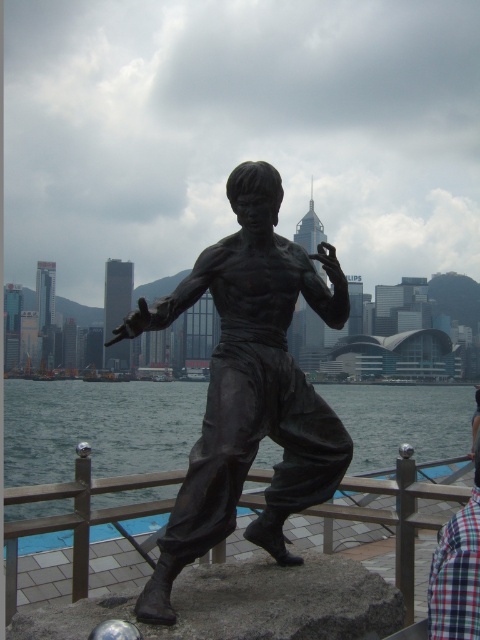
You are a tourist standing in front of the bronze statue of a martial artist. You notice a brown wooden rail at lower center and a plaid fabric shirt at lower right. Which object is closer to you?

The brown wooden rail at lower center is closer to you because it is further to the viewer than the plaid fabric shirt at lower right.

In the scene shown: You are a painter standing at the base of the bronze statue of a martial artist. You want to paint a scene that includes both the brown wooden rail at lower center and the plaid fabric shirt at lower right. Which object should you focus on first if you want to paint the wider object first?

The brown wooden rail at lower center should be focused on first because its width is larger than the plaid fabric shirt at lower right.

You are a tourist standing in front of the bronze statue at center and the brown wooden rail at lower center. You want to take a photo of the statue without the rail appearing in the frame. Which direction should you move to achieve this?

The bronze statue at center is in front of the brown wooden rail at lower center. To take a photo of the statue without the rail appearing in the frame, move to the side so that the statue is no longer aligned with the rail in your camera view.